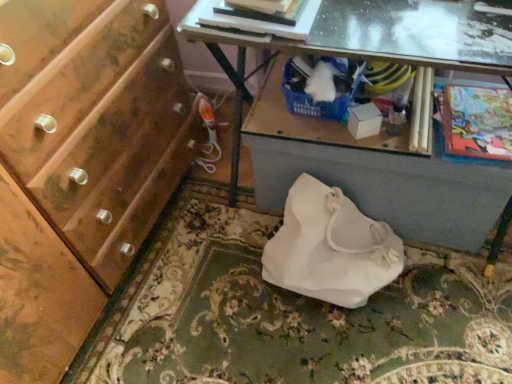
Question: From a real-world perspective, relative to matte black magazine at upper center, which is the 1th magazine in front-to-back order, is white fabric bag at center vertically above or below?

Choices:
 (A) above
 (B) below

Answer: (B)

Question: From the image's perspective, is white fabric bag at center above or below matte black magazine at upper center, positioned as the second magazine in bottom-to-top order?

Choices:
 (A) below
 (B) above

Answer: (A)

Question: Estimate the real-world distances between objects in this image. Which object is closer to the wooden magazine at right, which is the 2th magazine from left to right?

Choices:
 (A) transparent glass table at upper center
 (B) white fabric bag at lower center
 (C) cartoon paper comic book at right
 (D) matte black magazine at upper center, which is the 1th magazine in front-to-back order
 (E) white cardboard box at center

Answer: (C)

Question: Which object is positioned closest to the white fabric bag at lower center?

Choices:
 (A) wooden magazine at right, marked as the 2th magazine in a top-to-bottom arrangement
 (B) hardcover book at upper center
 (C) white cardboard box at center
 (D) matte black magazine at upper center, which is the 1th magazine in front-to-back order
 (E) white fabric bag at lower center

Answer: (C)